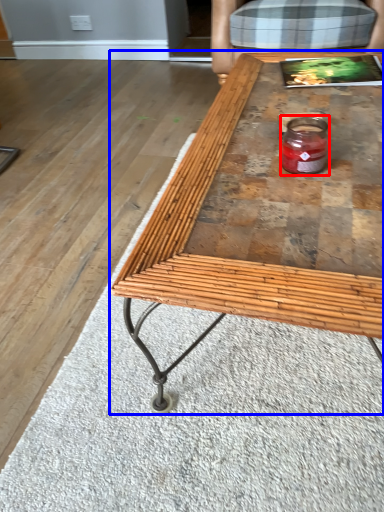
Question: Which object is further to the camera taking this photo, glass jar (highlighted by a red box) or coffee table (highlighted by a blue box)?

Choices:
 (A) glass jar
 (B) coffee table

Answer: (A)